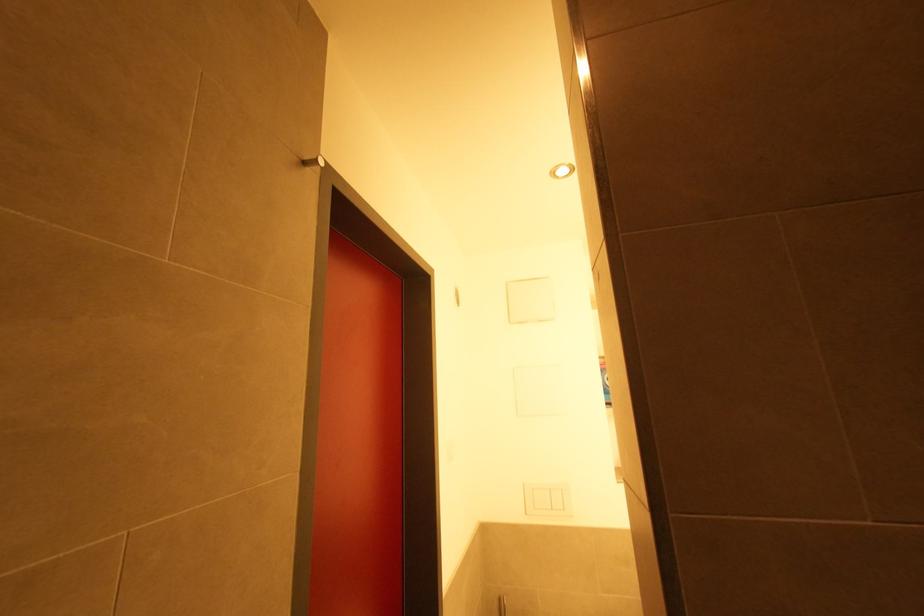
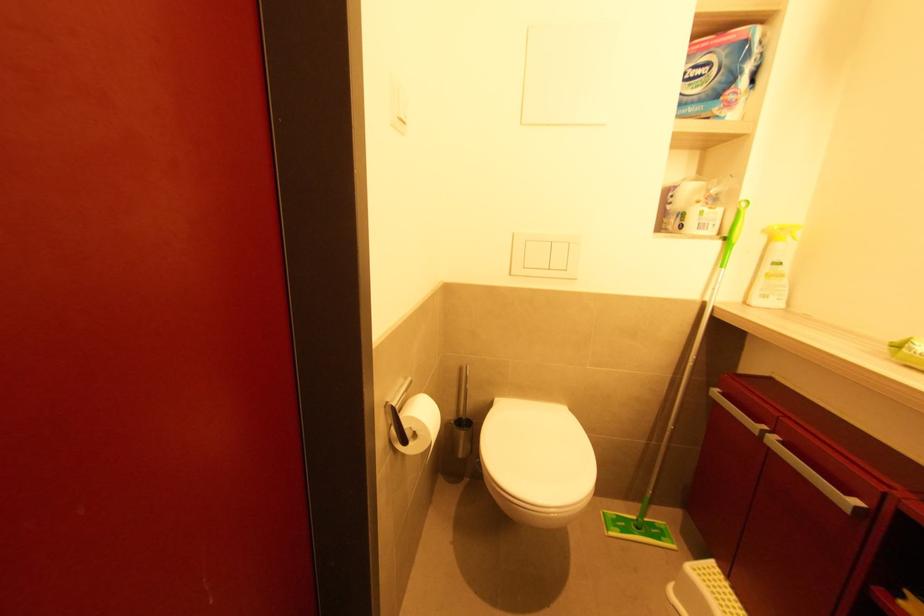
Question: Based on the continuous images, in which direction is the camera rotating? Reply with the corresponding letter.

Choices:
 (A) Left
 (B) Right
 (C) Up
 (D) Down

Answer: (D)